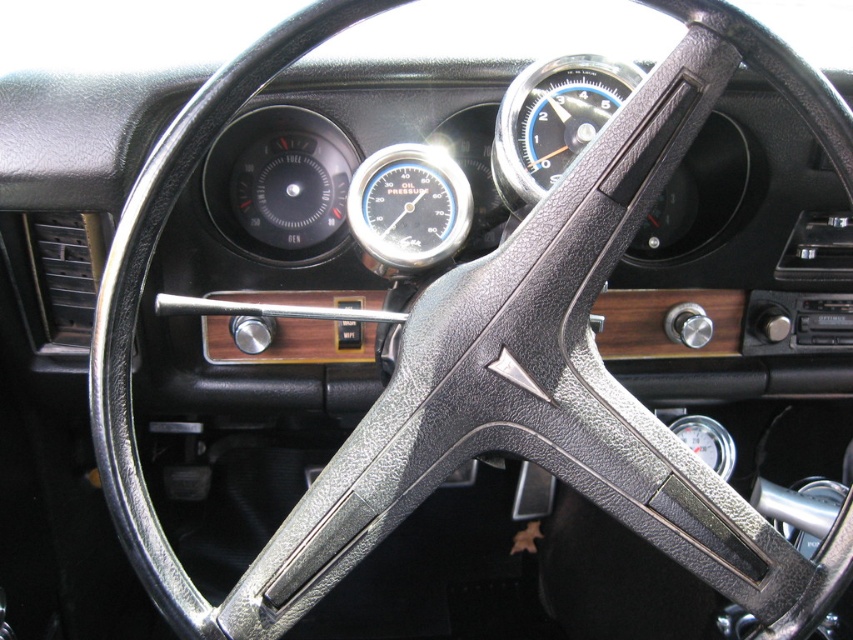
Between blue leather speedometer at upper center and matte black gauge at center, which one is positioned lower?

matte black gauge at center is below.

Is point (605, 104) less distant than point (357, 170)?

That is True.

Is point (554, 173) positioned after point (376, 186)?

No.

The height and width of the screenshot is (640, 853). I want to click on blue leather speedometer at upper center, so click(x=552, y=122).